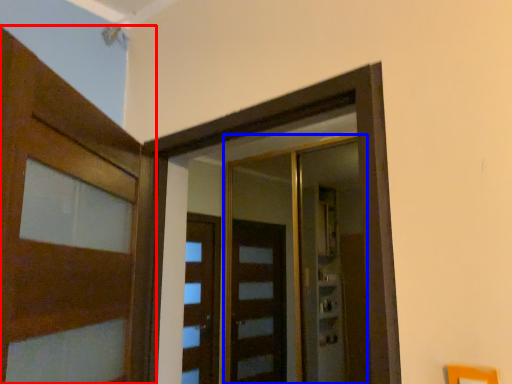
Question: Which of the following is the closest to the observer, door (highlighted by a red box) or elevator (highlighted by a blue box)?

Choices:
 (A) door
 (B) elevator

Answer: (A)